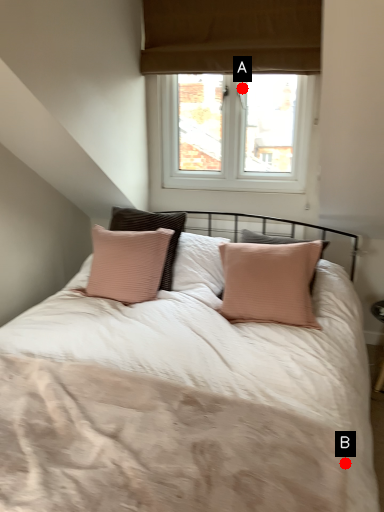
Question: Two points are circled on the image, labeled by A and B beside each circle. Which point appears farthest from the camera in this image?

Choices:
 (A) A is further
 (B) B is further

Answer: (A)